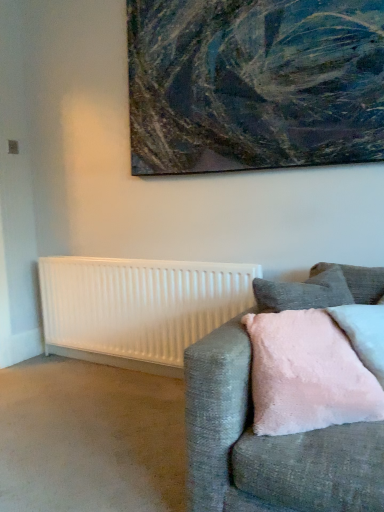
Question: From the image's perspective, is pink fluffy pillow at right positioned above or below white matte radiator at lower left?

Choices:
 (A) below
 (B) above

Answer: (B)

Question: Does point (379, 380) appear closer or farther from the camera than point (51, 263)?

Choices:
 (A) farther
 (B) closer

Answer: (B)

Question: Which object is positioned farthest from the textured gray couch at right?

Choices:
 (A) white matte radiator at lower left
 (B) textured canvas painting at upper center
 (C) pink fluffy pillow at right

Answer: (B)

Question: Considering the real-world distances, which object is closest to the pink fluffy pillow at right?

Choices:
 (A) white matte radiator at lower left
 (B) textured canvas painting at upper center
 (C) textured gray couch at right

Answer: (C)